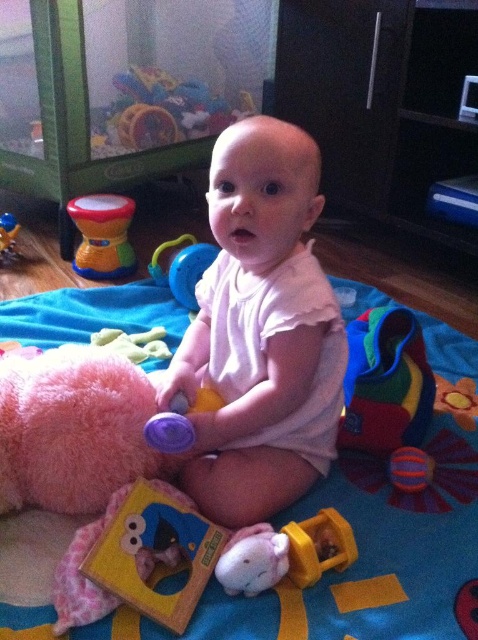
Can you confirm if multicolored fabric toy at center is positioned to the left of rubberized plastic rattle at lower left?

No, multicolored fabric toy at center is not to the left of rubberized plastic rattle at lower left.

Who is taller, multicolored fabric toy at center or rubberized plastic rattle at lower left?

With more height is multicolored fabric toy at center.

Is point (380, 310) farther from viewer compared to point (0, 232)?

That is False.

Identify the location of multicolored fabric toy at center. (386, 381).

Is multicolored fabric toy at center below yellow rubber teething ring at lower center?

Actually, multicolored fabric toy at center is above yellow rubber teething ring at lower center.

Is multicolored fabric toy at center to the left of yellow rubber teething ring at lower center from the viewer's perspective?

No, multicolored fabric toy at center is not to the left of yellow rubber teething ring at lower center.

This screenshot has width=478, height=640. Identify the location of multicolored fabric toy at center. (386, 381).

Is rainbow plastic drum at center further to camera compared to yellow rubber teething ring at lower center?

Yes, it is behind yellow rubber teething ring at lower center.

How much distance is there between rainbow plastic drum at center and yellow rubber teething ring at lower center?

A distance of 3.85 feet exists between rainbow plastic drum at center and yellow rubber teething ring at lower center.

Does point (105, 228) lie in front of point (328, 563)?

No, (105, 228) is further to viewer.

Where is `rainbow plastic drum at center`? The height and width of the screenshot is (640, 478). rainbow plastic drum at center is located at coordinates (102, 236).